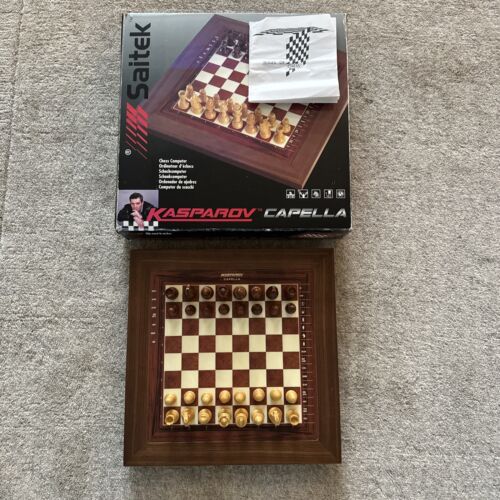
Locate an element on the screen. chess board is located at coordinates (257, 357).